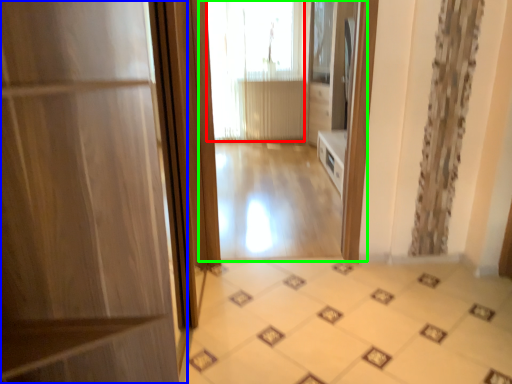
Question: Which object is the farthest from window (highlighted by a red box)? Choose among these: door (highlighted by a blue box) or residence (highlighted by a green box).

Choices:
 (A) door
 (B) residence

Answer: (A)